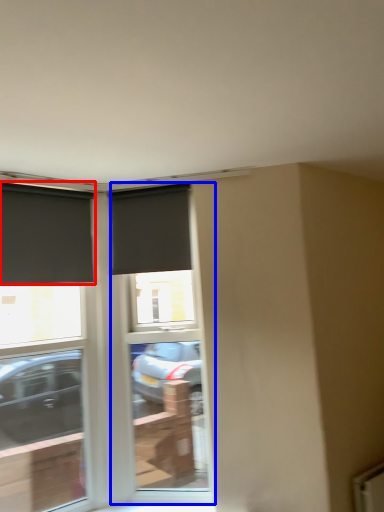
Question: Which object appears closest to the camera in this image, window (highlighted by a red box) or screen door (highlighted by a blue box)?

Choices:
 (A) window
 (B) screen door

Answer: (A)